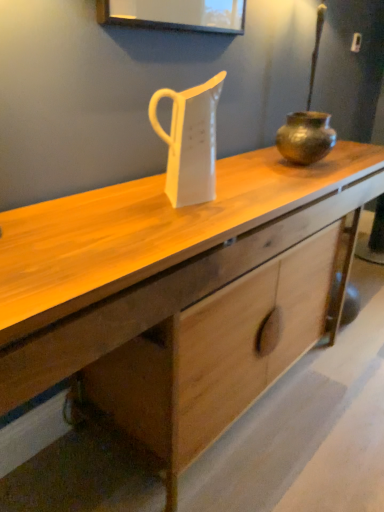
Question: Are white glossy jug at center and wooden desk at center far apart?

Choices:
 (A) no
 (B) yes

Answer: (A)

Question: From the image's perspective, is white glossy jug at center below wooden desk at center?

Choices:
 (A) yes
 (B) no

Answer: (B)

Question: Is white glossy jug at center to the right of wooden desk at center from the viewer's perspective?

Choices:
 (A) no
 (B) yes

Answer: (A)

Question: Considering the relative positions of white glossy jug at center and wooden desk at center in the image provided, is white glossy jug at center in front of wooden desk at center?

Choices:
 (A) no
 (B) yes

Answer: (A)

Question: Considering the relative sizes of white glossy jug at center and wooden desk at center in the image provided, is white glossy jug at center smaller than wooden desk at center?

Choices:
 (A) no
 (B) yes

Answer: (B)

Question: Is white glossy jug at center looking in the opposite direction of wooden desk at center?

Choices:
 (A) yes
 (B) no

Answer: (B)

Question: Can you confirm if wooden desk at center is taller than bronze metallic pot at right?

Choices:
 (A) no
 (B) yes

Answer: (B)

Question: Is wooden desk at center facing away from bronze metallic pot at right?

Choices:
 (A) yes
 (B) no

Answer: (B)

Question: Can you confirm if wooden desk at center is smaller than bronze metallic pot at right?

Choices:
 (A) yes
 (B) no

Answer: (B)

Question: Are wooden desk at center and bronze metallic pot at right making contact?

Choices:
 (A) no
 (B) yes

Answer: (A)

Question: Is wooden desk at center at the right side of bronze metallic pot at right?

Choices:
 (A) no
 (B) yes

Answer: (A)

Question: Is wooden desk at center at the left side of bronze metallic pot at right?

Choices:
 (A) no
 (B) yes

Answer: (B)

Question: Does white glossy jug at center appear on the right side of bronze textured pot at center?

Choices:
 (A) no
 (B) yes

Answer: (A)